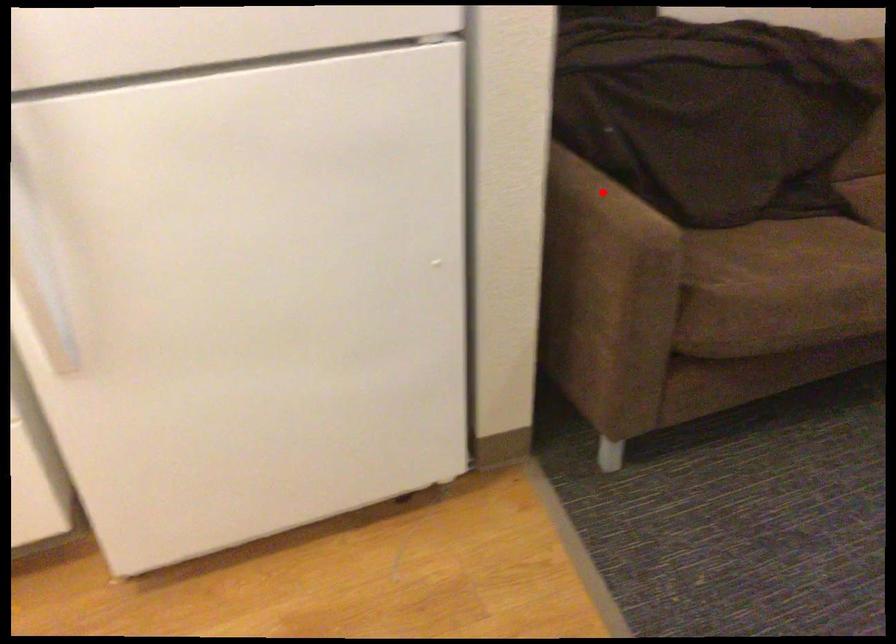
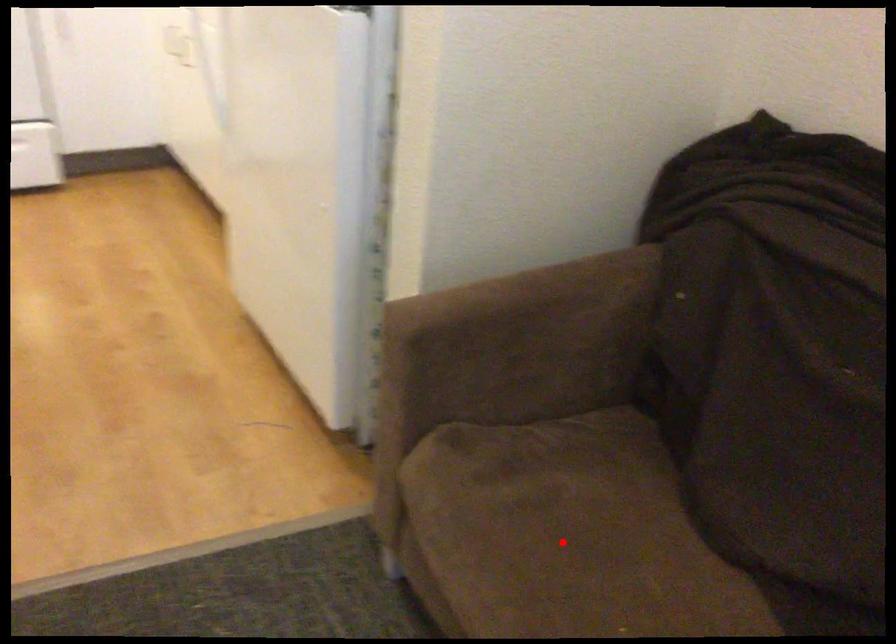
I am providing you with two images of the same scene from different viewpoints. A red point is marked on the first image and another point is marked on the second image. Are the points marked in image1 and image2 representing the same 3D position?

No